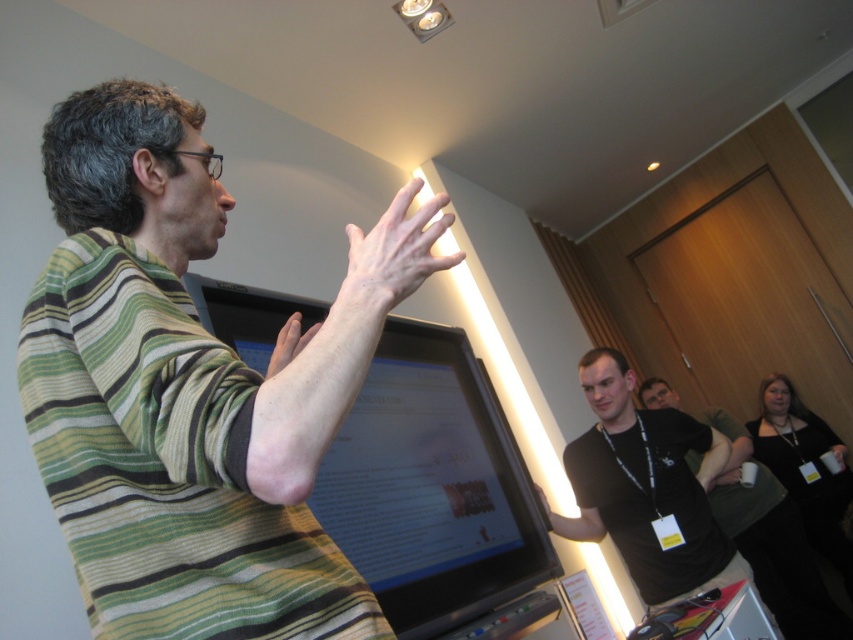
You are standing in the room and want to hand a document to the person wearing the black matte shirt at right. Based on their position in the scene, which direction should you move to approach them?

The black matte shirt at right is located at point (646, 486), so you should move towards the right side of the room to reach them.

You are a security guard in this room with a 1.2 meter detection range. You notice the matte skin hand at upper center and the matte black hand at center. Can your detection system reach both hands?

The distance between the matte skin hand at upper center and the matte black hand at center is 1.22 meters. Since your detection range is 1.2 meters, the system cannot fully cover both hands as the distance exceeds the range by 0.02 meters.